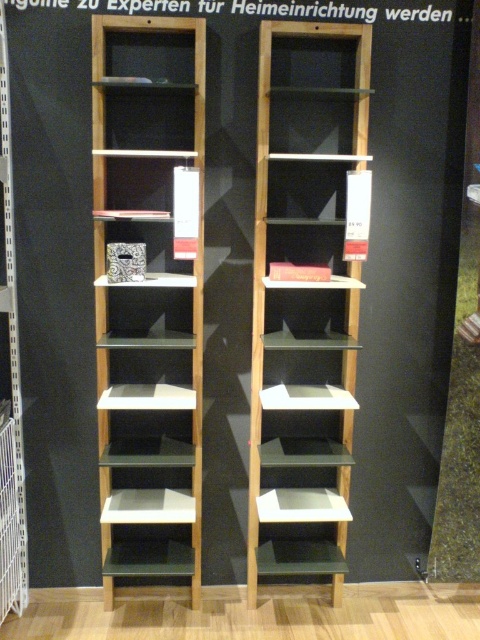
You are standing in a room and want to place a decorative plant pot that requires a space 2 meters away from the viewer. Can the light brown wood bookshelf at center accommodate this requirement?

The light brown wood bookshelf at center is 2.11 meters away from the viewer, which is slightly further than the required 2 meters. Therefore, it can accommodate the plant pot as it meets the distance requirement.

You are standing in front of two bookshelves. The matte oak bookshelf at center and the light brown wood bookshelf at center. Which one do you see first when looking straight ahead?

The matte oak bookshelf at center is closer to the viewer than the light brown wood bookshelf at center, so you will see it first when looking straight ahead.